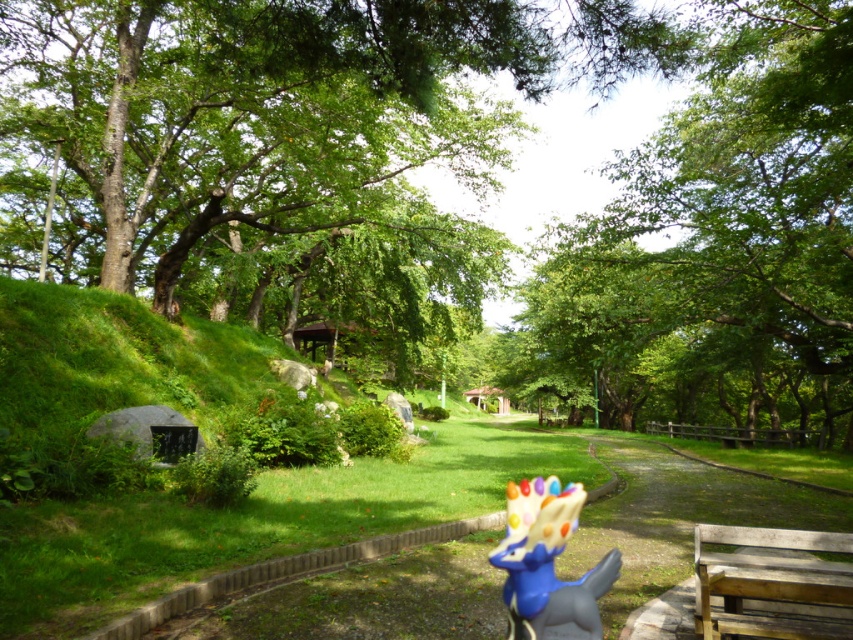
Does green leafy tree at upper center appear on the left side of shiny plastic toy at center?

No, green leafy tree at upper center is not to the left of shiny plastic toy at center.

Is green leafy tree at upper center below shiny plastic toy at center?

No, green leafy tree at upper center is not below shiny plastic toy at center.

The width and height of the screenshot is (853, 640). I want to click on green leafy tree at upper center, so click(x=720, y=241).

Can you confirm if green leafy tree at upper center is thinner than wooden bench at lower right?

Incorrect, green leafy tree at upper center's width is not less than wooden bench at lower right's.

Between point (706, 170) and point (769, 566), which one is positioned behind?

The point (706, 170) is behind.

Where is `green leafy tree at upper center`? Image resolution: width=853 pixels, height=640 pixels. green leafy tree at upper center is located at coordinates (720, 241).

Measure the distance between wooden bench at lower right and camera.

The distance of wooden bench at lower right from camera is 12.21 feet.

Is point (839, 616) positioned after point (550, 502)?

Yes, it is.

Identify the location of wooden bench at lower right. (770, 582).